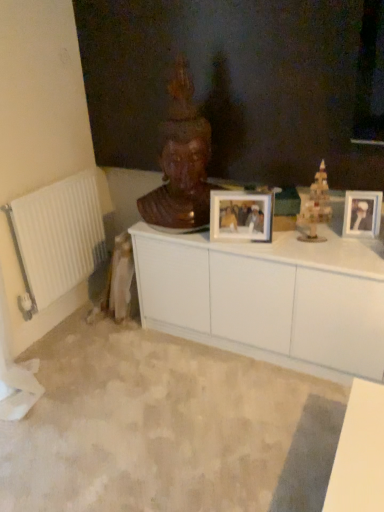
At what (x,y) coordinates should I click in order to perform the action: click on vacant area that is in front of wooden tower at upper right. Please return your answer as a coordinate pair (x, y). The image size is (384, 512). Looking at the image, I should click on (327, 253).